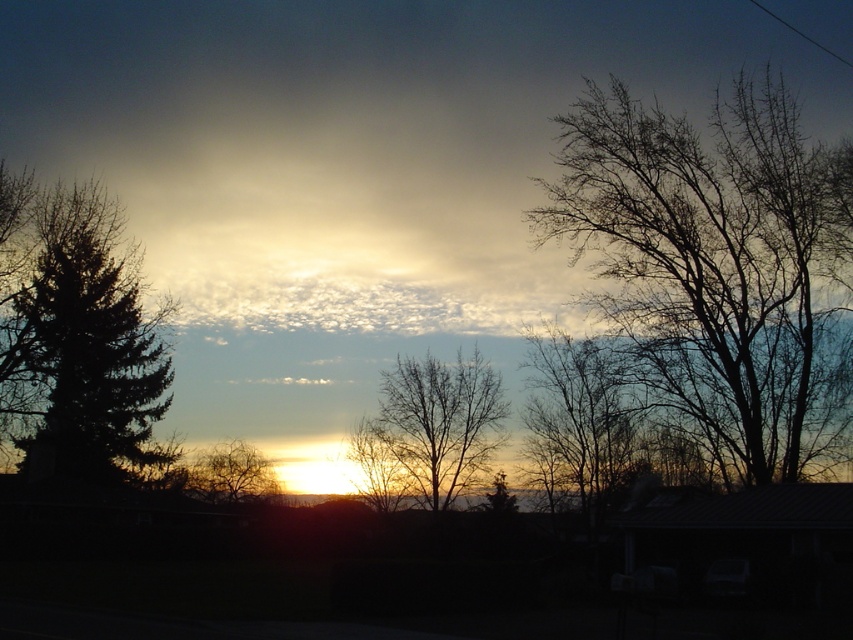
You are an artist trying to paint the sunset scene. You want to ensure the bare branches at right and the bare branches at center are positioned correctly in terms of depth. Which of these two objects should appear closer to you in your painting?

The bare branches at right should appear closer to you in your painting because they are positioned in front of the bare branches at center.

You are a photographer trying to capture the sunset. You want to include the bare branches at right in your shot. Based on their position, where should you aim your camera?

The bare branches at right are located at point [711,264], so aim your camera towards the upper right area of the scene.